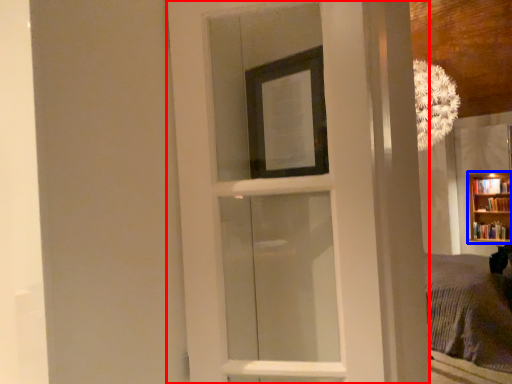
Question: Which object appears farthest to the camera in this image, door (highlighted by a red box) or bookcase (highlighted by a blue box)?

Choices:
 (A) door
 (B) bookcase

Answer: (B)